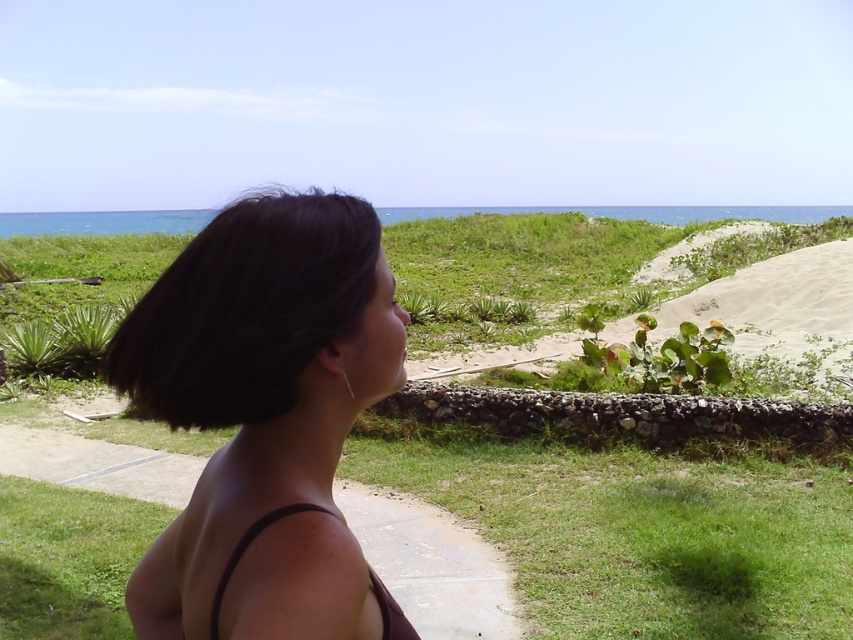
Is brown concrete path at lower center bigger than black matte bikini top at lower left?

Correct, brown concrete path at lower center is larger in size than black matte bikini top at lower left.

Can you confirm if brown concrete path at lower center is wider than black matte bikini top at lower left?

Answer: Correct, the width of brown concrete path at lower center exceeds that of black matte bikini top at lower left.

Which is in front, point (142, 467) or point (212, 609)?

Point (212, 609) is more forward.

Find the location of a particular element. brown concrete path at lower center is located at coordinates (432, 563).

Can you confirm if dark brown hair at center is positioned above dark shiny hair at center?

No.

Who is higher up, dark brown hair at center or dark shiny hair at center?

dark shiny hair at center

Image resolution: width=853 pixels, height=640 pixels. What do you see at coordinates (265, 419) in the screenshot? I see `dark brown hair at center` at bounding box center [265, 419].

In order to click on dark brown hair at center in this screenshot , I will do `click(265, 419)`.

Does point (358, 627) come closer to viewer compared to point (392, 637)?

Yes, it is in front of point (392, 637).

The height and width of the screenshot is (640, 853). Identify the location of dark brown hair at center. (265, 419).